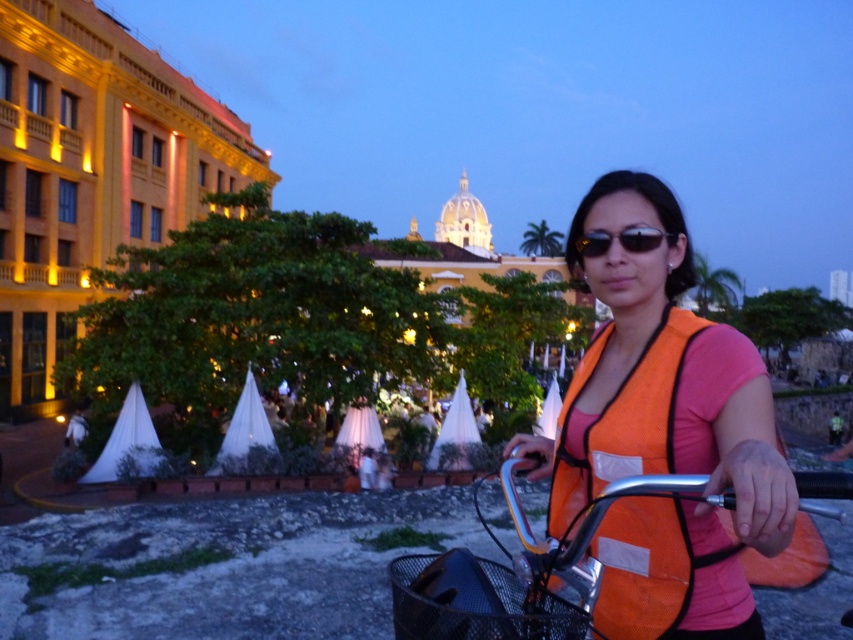
Is metallic silver bicycle at center positioned before black mesh basket at center?

Yes, metallic silver bicycle at center is in front of black mesh basket at center.

Is metallic silver bicycle at center taller than black mesh basket at center?

Yes, metallic silver bicycle at center is taller than black mesh basket at center.

Find the location of a particular element. metallic silver bicycle at center is located at coordinates (520, 572).

I want to click on metallic silver bicycle at center, so click(520, 572).

Who is shorter, black mesh basket at center or black reflective sunglasses at center?

black reflective sunglasses at center is shorter.

Does black mesh basket at center appear over black reflective sunglasses at center?

Incorrect, black mesh basket at center is not positioned above black reflective sunglasses at center.

The height and width of the screenshot is (640, 853). What are the coordinates of `black mesh basket at center` in the screenshot? It's located at (474, 602).

Does point (614, 248) lie in front of point (637, 252)?

No, (614, 248) is further to viewer.

Is orange mesh vest at center above black reflective sunglasses at center?

Incorrect, orange mesh vest at center is not positioned above black reflective sunglasses at center.

Find the location of a particular element. This screenshot has width=853, height=640. orange mesh vest at center is located at coordinates (660, 380).